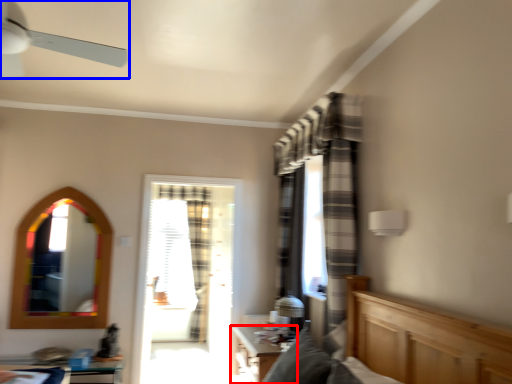
Question: Among these objects, which one is nearest to the camera, table (highlighted by a red box) or ceiling fan (highlighted by a blue box)?

Choices:
 (A) table
 (B) ceiling fan

Answer: (B)